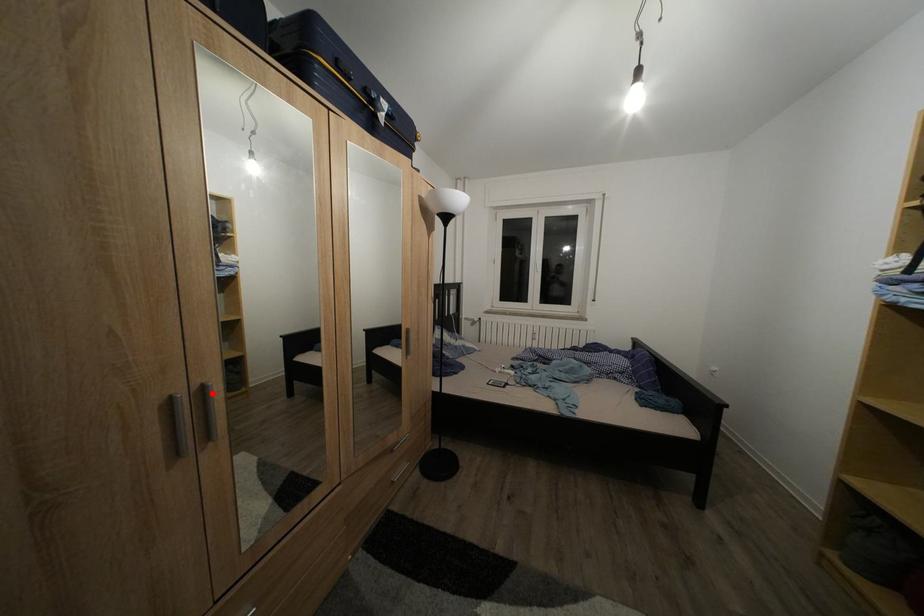
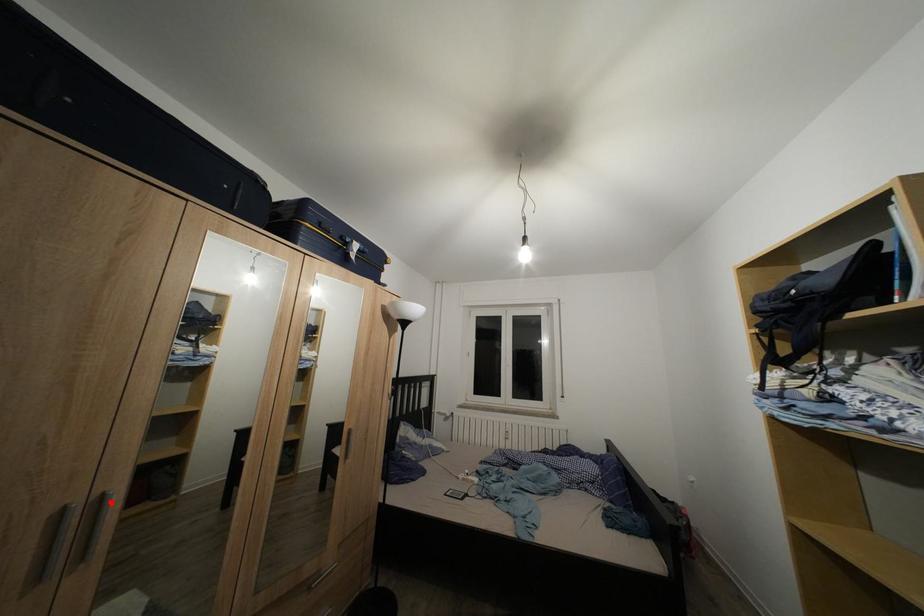
I am providing you with two images of the same scene from different viewpoints. A red point is marked on the first image and another point is marked on the second image. Do the highlighted points in image1 and image2 indicate the same real-world spot?

Yes